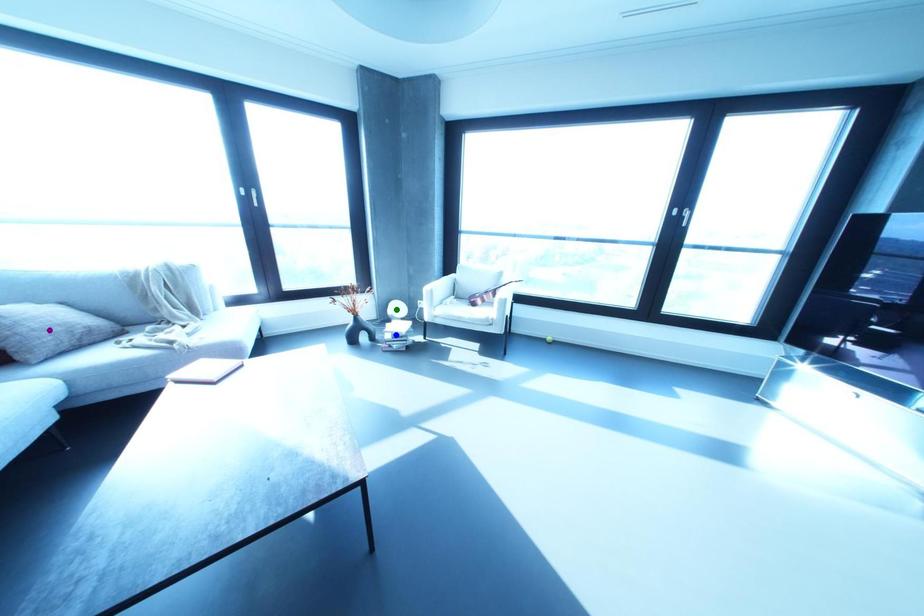
Order these from nearest to farthest:
green point | purple point | blue point

green point
blue point
purple point